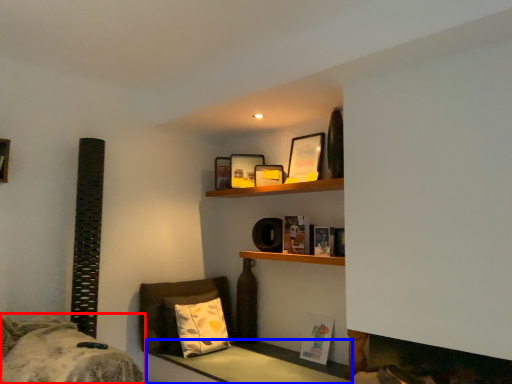
Question: Which object appears farthest to the camera in this image, bed (highlighted by a red box) or table (highlighted by a blue box)?

Choices:
 (A) bed
 (B) table

Answer: (B)